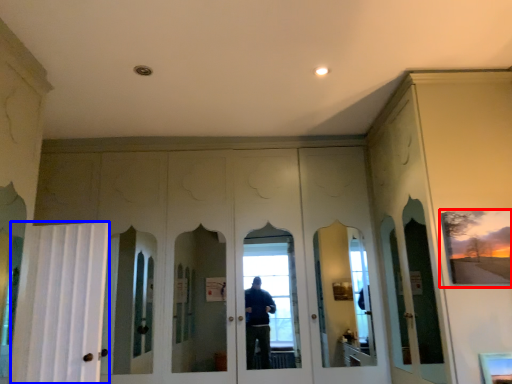
Question: Which point is closer to the camera, picture frame (highlighted by a red box) or curtain (highlighted by a blue box)?

Choices:
 (A) picture frame
 (B) curtain

Answer: (A)